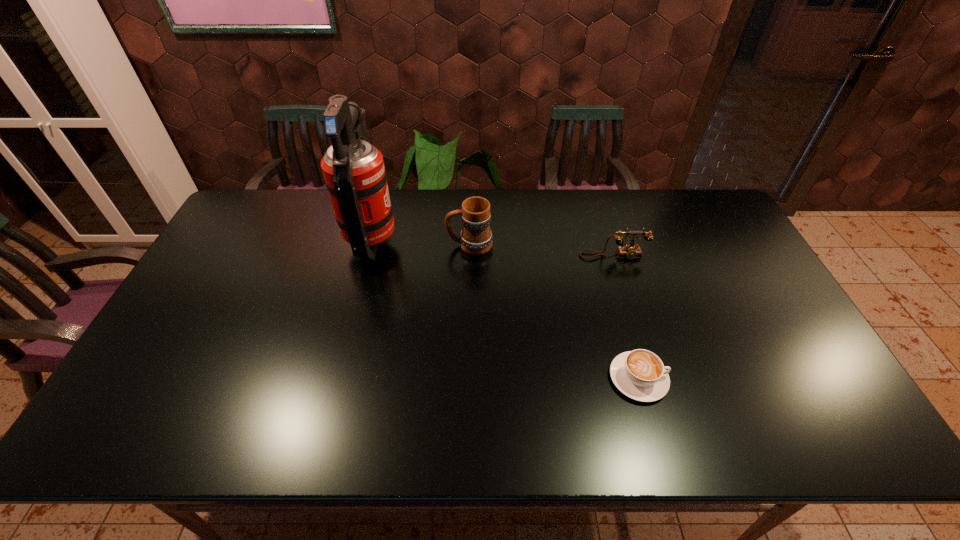
Find the location of a particular element. Image resolution: width=960 pixels, height=540 pixels. the tallest object is located at coordinates (353, 169).

Locate an element on the screen. fire extinguisher is located at coordinates (353, 169).

Where is `the third shortest object`? Image resolution: width=960 pixels, height=540 pixels. the third shortest object is located at coordinates (476, 237).

Where is `the third object from right to left`? the third object from right to left is located at coordinates (476, 237).

This screenshot has height=540, width=960. I want to click on telephone, so click(x=630, y=251).

Where is `the shortest object`? The width and height of the screenshot is (960, 540). the shortest object is located at coordinates (640, 374).

Where is `cappuccino`? Image resolution: width=960 pixels, height=540 pixels. cappuccino is located at coordinates tap(640, 374).

Where is `vacant space located 0.320m on the front label side of the tallest object`? This screenshot has width=960, height=540. vacant space located 0.320m on the front label side of the tallest object is located at coordinates (x=495, y=240).

Identify the location of vacant space located 0.150m on the side of the third shortest object with the handle. (400, 245).

Locate an element on the screen. The width and height of the screenshot is (960, 540). vacant space located on the side of the third shortest object with the handle is located at coordinates (336, 245).